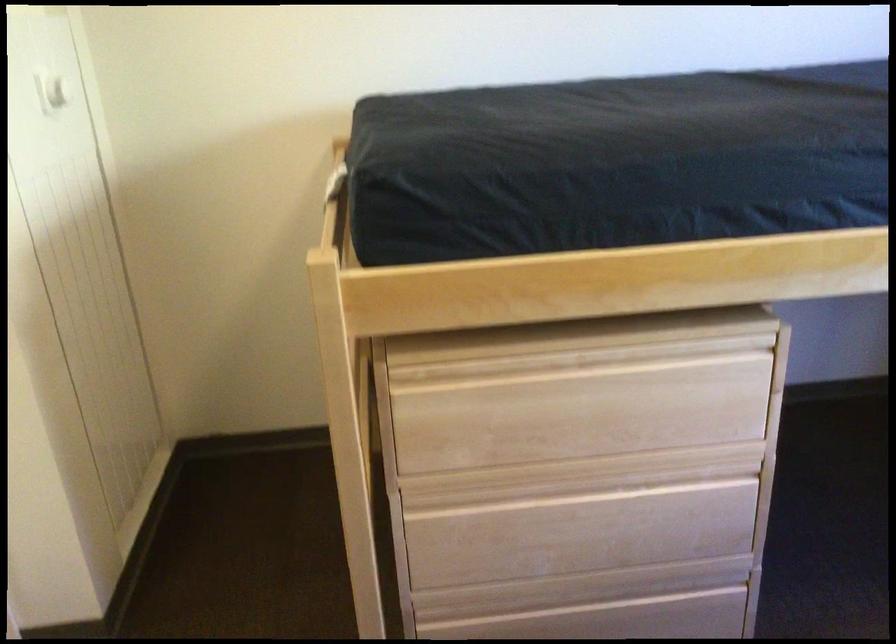
The width and height of the screenshot is (896, 644). I want to click on white door handle, so click(x=55, y=90).